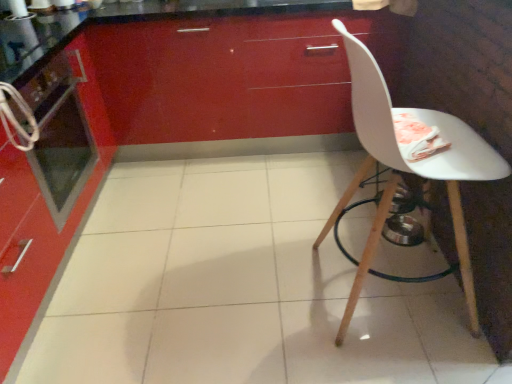
The width and height of the screenshot is (512, 384). In order to click on vacant space situated on the left part of white matte chair at right in this screenshot , I will do `click(269, 299)`.